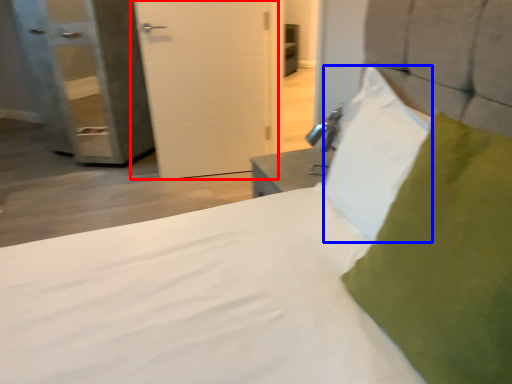
Question: Among these objects, which one is farthest to the camera, door (highlighted by a red box) or pillow (highlighted by a blue box)?

Choices:
 (A) door
 (B) pillow

Answer: (A)